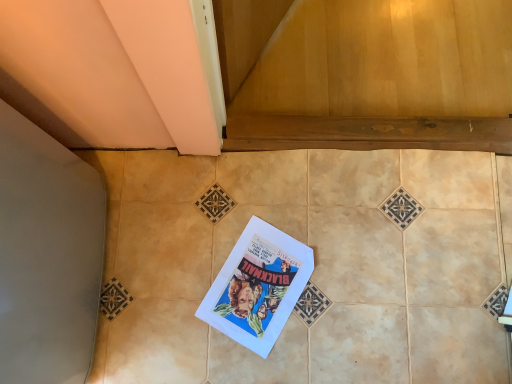
Question: From the image's perspective, is white paper comic book at center positioned above or below beige ceramic tile at center?

Choices:
 (A) above
 (B) below

Answer: (B)

Question: Visually, is white paper comic book at center positioned to the left or to the right of beige ceramic tile at center?

Choices:
 (A) right
 (B) left

Answer: (B)

Question: Based on their sizes in the image, would you say white paper comic book at center is bigger or smaller than beige ceramic tile at center?

Choices:
 (A) big
 (B) small

Answer: (B)

Question: Considering their positions, is beige ceramic tile at center located in front of or behind white paper comic book at center?

Choices:
 (A) front
 (B) behind

Answer: (A)

Question: In terms of width, does beige ceramic tile at center look wider or thinner when compared to white paper comic book at center?

Choices:
 (A) wide
 (B) thin

Answer: (A)

Question: From a real-world perspective, relative to white paper comic book at center, is beige ceramic tile at center vertically above or below?

Choices:
 (A) above
 (B) below

Answer: (A)

Question: Based on their positions, is beige ceramic tile at center located to the left or right of white paper comic book at center?

Choices:
 (A) left
 (B) right

Answer: (B)